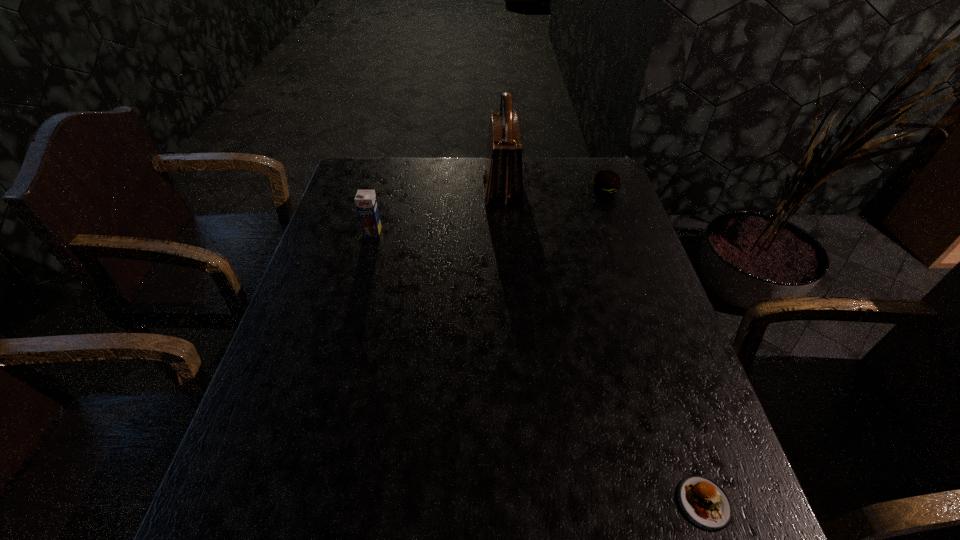
Identify the location of free space that satisfies the following two spatial constraints: 1. on the front label of the nearer patty (food); 2. on the left side of the second tallest object. Image resolution: width=960 pixels, height=540 pixels. (300, 503).

This screenshot has width=960, height=540. In order to click on vacant region that satisfies the following two spatial constraints: 1. on the front flap of the tallest object; 2. on the front label of the third shortest object in this screenshot , I will do `click(505, 232)`.